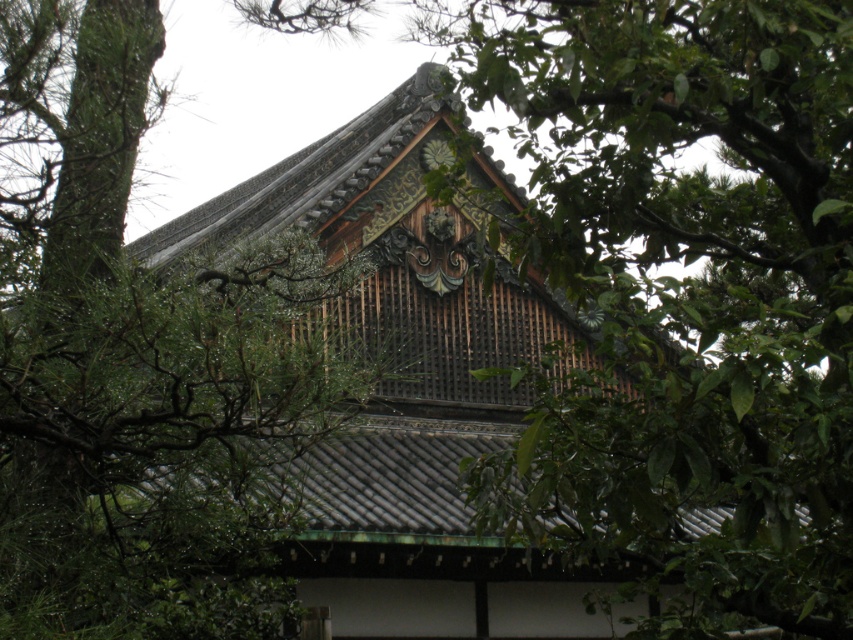
Question: Which point is farther from the camera taking this photo?

Choices:
 (A) (695, 468)
 (B) (277, 540)
 (C) (364, 196)

Answer: (C)

Question: Among these objects, which one is nearest to the camera?

Choices:
 (A) green leafy tree at upper left
 (B) green leafy tree at center

Answer: (B)

Question: Which object is closer to the camera taking this photo?

Choices:
 (A) green leafy tree at upper left
 (B) shiny dark brown wooden roof at center
 (C) green leafy tree at center

Answer: (C)

Question: Can you confirm if green leafy tree at upper left is smaller than shiny dark brown wooden roof at center?

Choices:
 (A) no
 (B) yes

Answer: (B)

Question: Does green leafy tree at center appear over green leafy tree at upper left?

Choices:
 (A) yes
 (B) no

Answer: (A)

Question: Can you confirm if green leafy tree at upper left is smaller than shiny dark brown wooden roof at center?

Choices:
 (A) yes
 (B) no

Answer: (A)